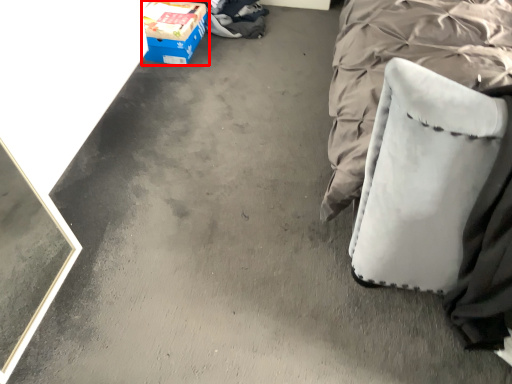
Question: From the image, what is the correct spatial relationship of box (annotated by the red box) in relation to swivel chair?

Choices:
 (A) right
 (B) left

Answer: (B)